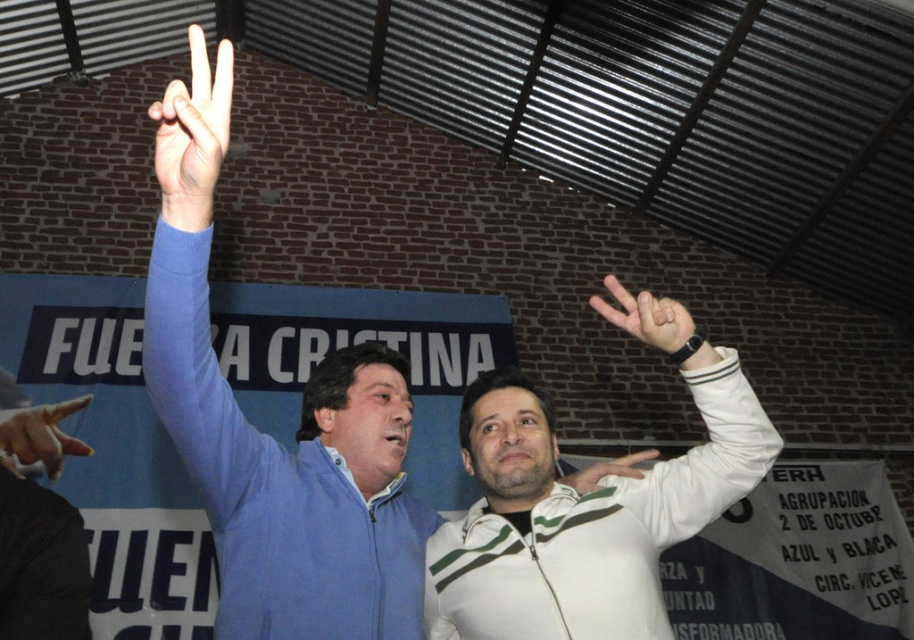
Question: Does matte white hand at upper center appear over white matte hand at center?

Choices:
 (A) yes
 (B) no

Answer: (A)

Question: Which point is closer to the camera?

Choices:
 (A) (169, 227)
 (B) (710, 356)

Answer: (A)

Question: Estimate the real-world distances between objects in this image. Which object is closer to the skinny finger at upper left?

Choices:
 (A) white striped jacket at upper right
 (B) white striped jacket at center

Answer: (B)

Question: Which object is farther from the camera taking this photo?

Choices:
 (A) blue zip-up jacket at upper left
 (B) white striped jacket at center
 (C) white matte hand at center
 (D) skinny finger at upper left

Answer: (D)

Question: Does white striped jacket at center have a smaller size compared to white striped jacket at upper right?

Choices:
 (A) no
 (B) yes

Answer: (A)

Question: Does blue zip-up jacket at upper left come in front of matte blue hand at upper left?

Choices:
 (A) no
 (B) yes

Answer: (B)